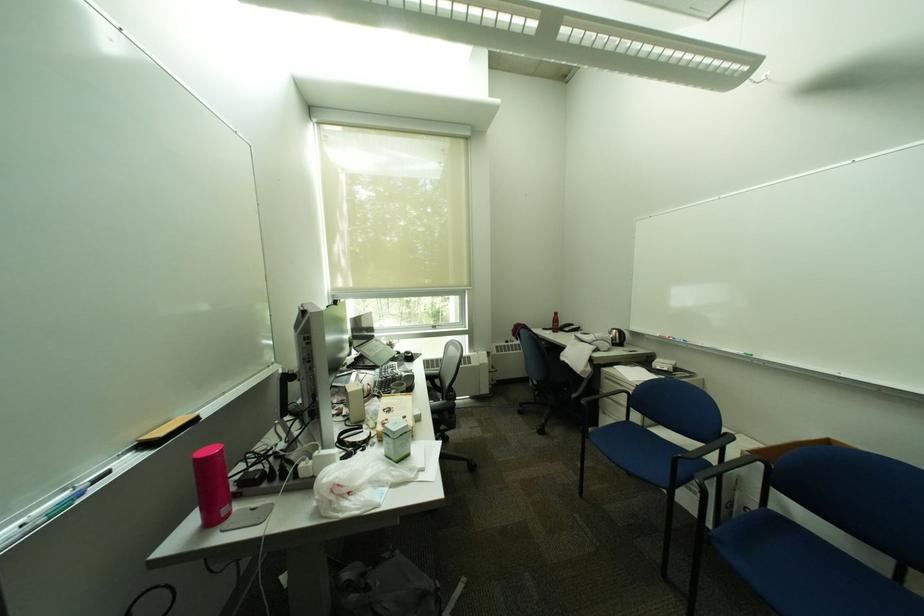
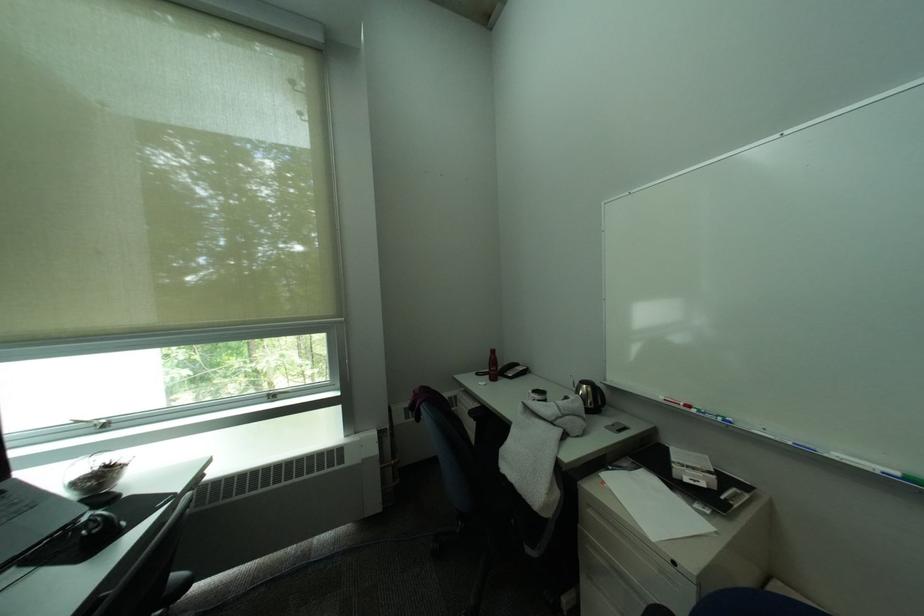
Find the pixel in the second image that matches [554,331] in the first image.

(488, 376)